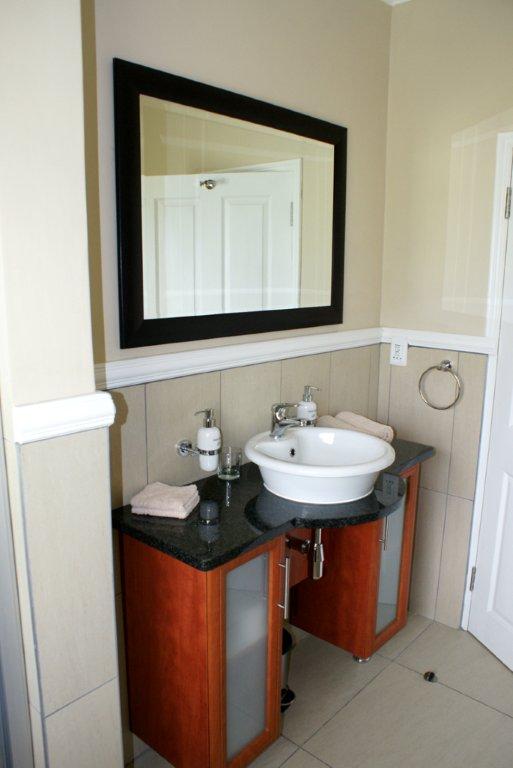
You are a GUI agent. You are given a task and a screenshot of the screen. Output one action in this format:
    pyautogui.click(x=<x>, y=<y>)
    Task: Click on the mirror
    Image resolution: width=513 pixels, height=768 pixels.
    Given the screenshot: What is the action you would take?
    pyautogui.click(x=267, y=224)